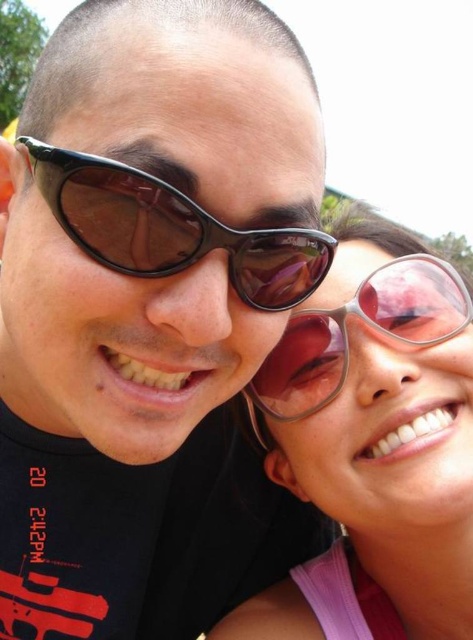
You are taking a photo of two people wearing sunglasses. The black plastic sunglasses at center and the pink translucent sunglasses at center are both in the frame. Which pair of sunglasses is covering the other?

The black plastic sunglasses at center is positioned over the pink translucent sunglasses at center, so it is covering the pink ones.

You are taking a photo of two people wearing sunglasses. You notice that the matte black sunglasses at center and the black plastic sunglasses at center are positioned such that one is taller than the other. Which pair of sunglasses is taller?

The matte black sunglasses at center is taller than the black plastic sunglasses at center.